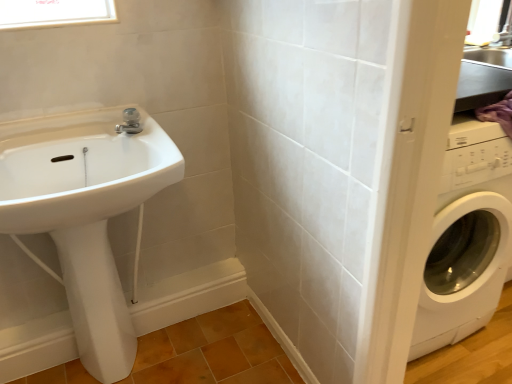
Find the location of a particular element. This screenshot has height=384, width=512. vacant area situated to the left side of satin nickel faucet at upper center is located at coordinates (80, 134).